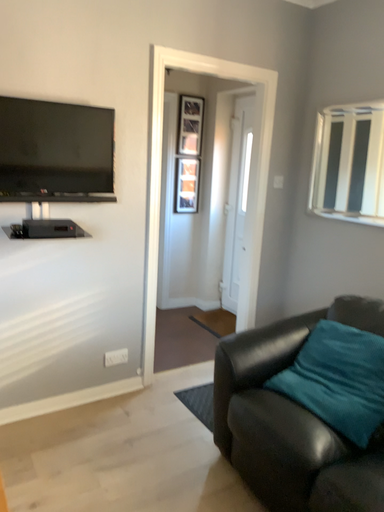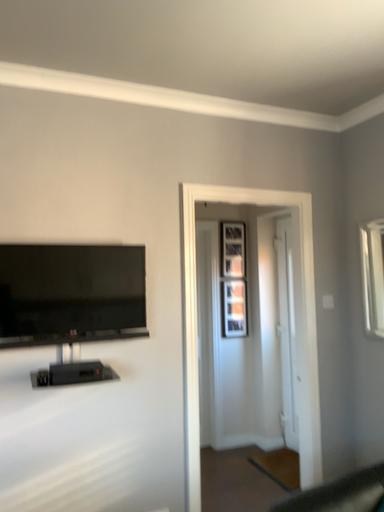
Question: Which way did the camera rotate in the video?

Choices:
 (A) rotated downward
 (B) rotated upward

Answer: (B)